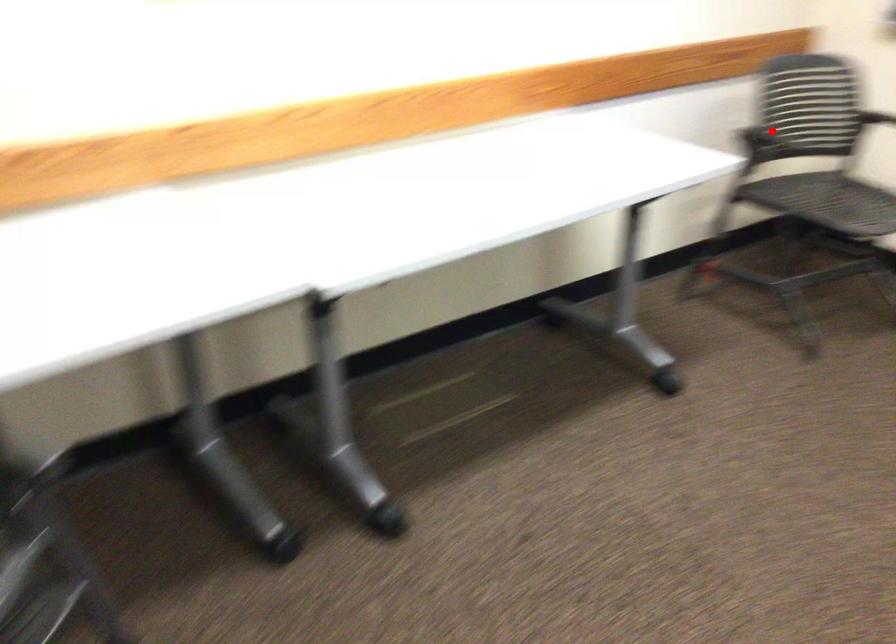
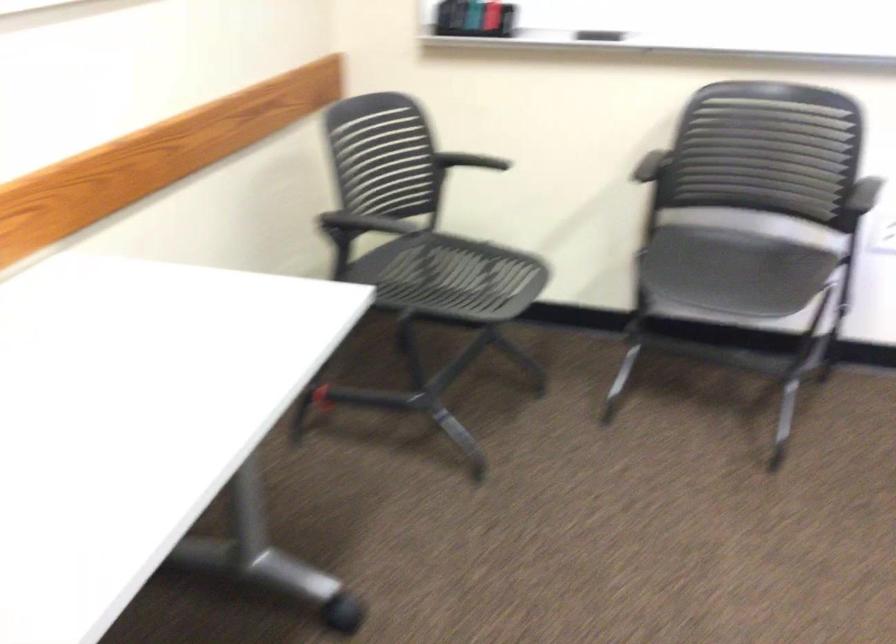
Locate, in the second image, the point that corresponds to the highlighted location in the first image.

(364, 223)